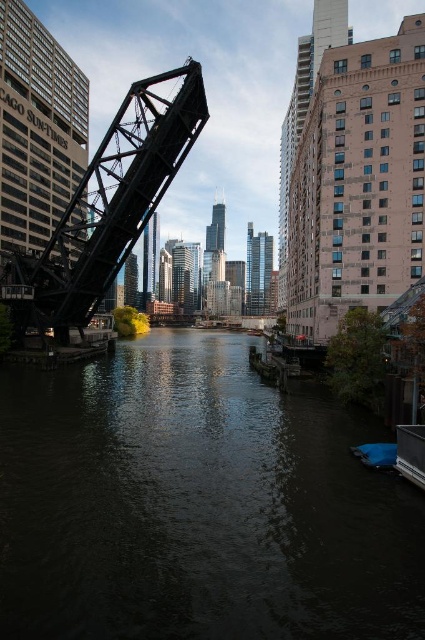
Looking at this image, you are standing at the Chicago Sun Times building on the left side of the river. You see two points marked in the image, point 1 at coordinates point (277,481) and point 2 at coordinates point (373,452). Which point is closer to you?

Point (277,481) is closer to the viewer than point (373,452).

You are standing on the Chicago Sun Times building on the left side of the image. You see a point at coordinates point (197,504). Is this point located on the dark water at center?

Yes, the point (197,504) is located on the dark water at center.

You are a photographer standing on the riverbank and want to capture both the black steel bridge at left and the blue fabric boat at lower right in the same frame. Which object will appear larger in your photo?

The black steel bridge at left will appear larger in the photo because it is much taller than the blue fabric boat at lower right.